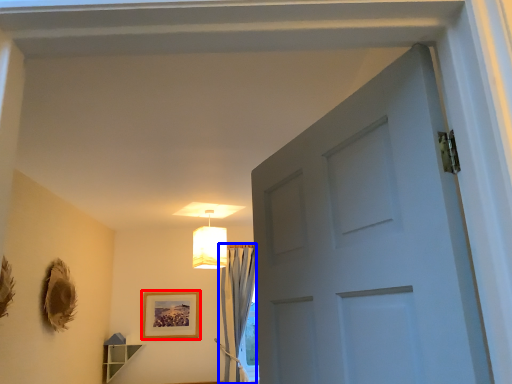
Question: Which of the following is the closest to the observer, picture frame (highlighted by a red box) or curtain (highlighted by a blue box)?

Choices:
 (A) picture frame
 (B) curtain

Answer: (B)